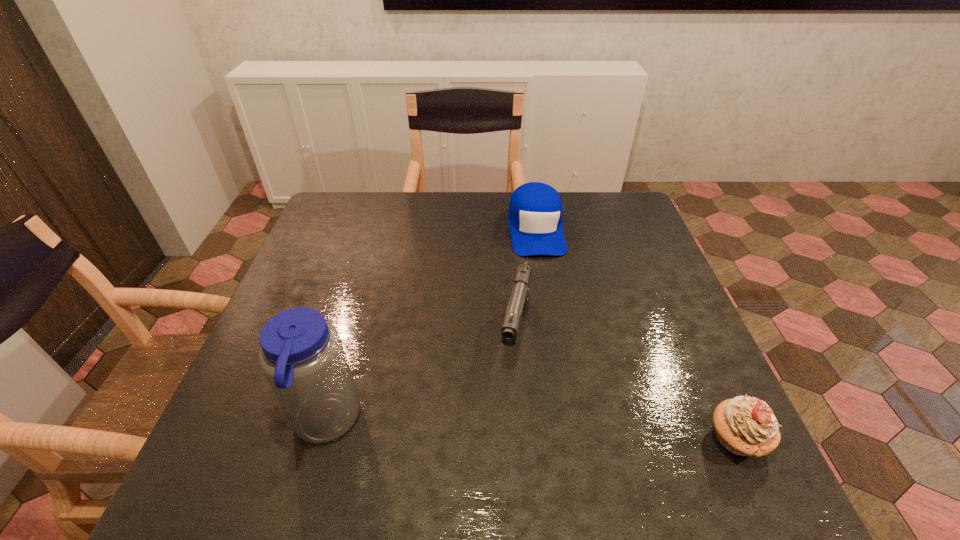
Find the location of a particular element. This screenshot has height=540, width=960. free space located on the front-facing side of the baseball cap is located at coordinates (556, 343).

This screenshot has height=540, width=960. Identify the location of free space located 0.150m on the front-facing side of the baseball cap. (547, 295).

Image resolution: width=960 pixels, height=540 pixels. What are the coordinates of `object that is positioned at the far edge` in the screenshot? It's located at (535, 209).

Locate an element on the screen. water bottle at the near edge is located at coordinates (302, 357).

What are the coordinates of `cupcake that is at the near edge` in the screenshot? It's located at (745, 426).

At what (x,y) coordinates should I click in order to perform the action: click on object at the left edge. Please return your answer as a coordinate pair (x, y). Looking at the image, I should click on (302, 357).

The width and height of the screenshot is (960, 540). In order to click on object present at the right edge in this screenshot , I will do `click(745, 426)`.

The image size is (960, 540). Identify the location of object that is positioned at the near left corner. (302, 357).

Where is `object that is at the near right corner`? The width and height of the screenshot is (960, 540). object that is at the near right corner is located at coordinates (745, 426).

You are a GUI agent. You are given a task and a screenshot of the screen. Output one action in this format:
    pyautogui.click(x=<x>, y=<y>)
    Task: Click on the blank space at the far edge of the desktop
    
    Given the screenshot: What is the action you would take?
    pyautogui.click(x=404, y=203)